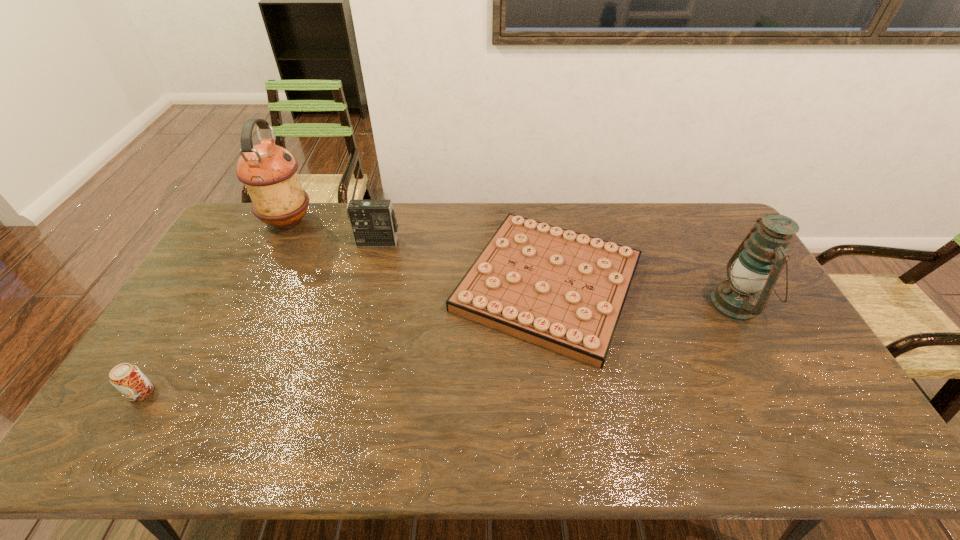
The image size is (960, 540). Find the location of `unoccupied position between the fourth tallest object and the gameboard`. unoccupied position between the fourth tallest object and the gameboard is located at coordinates (345, 339).

Identify the location of the closest object to the farther oil lamp. (373, 222).

Locate which object is the fourth closest to the radio receiver. Please provide its 2D coordinates. Your answer should be formatted as a tuple, i.e. [(x, y)], where the tuple contains the x and y coordinates of a point satisfying the conditions above.

[(757, 263)]

Locate an element on the screen. free spot that satisfies the following two spatial constraints: 1. on the front side of the shorter oil lamp; 2. on the left side of the taller oil lamp is located at coordinates (246, 304).

Identify the location of vacant space that satisfies the following two spatial constraints: 1. on the display of the right oil lamp; 2. on the right side of the radio receiver. The image size is (960, 540). (362, 304).

Where is `vacant area in the image that satisfies the following two spatial constraints: 1. on the display of the nearer oil lamp; 2. on the right side of the radio receiver`? Image resolution: width=960 pixels, height=540 pixels. vacant area in the image that satisfies the following two spatial constraints: 1. on the display of the nearer oil lamp; 2. on the right side of the radio receiver is located at coordinates (362, 304).